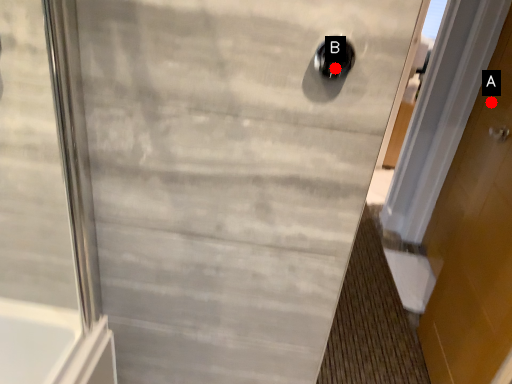
Question: Two points are circled on the image, labeled by A and B beside each circle. Which point is further to the camera?

Choices:
 (A) A is further
 (B) B is further

Answer: (A)